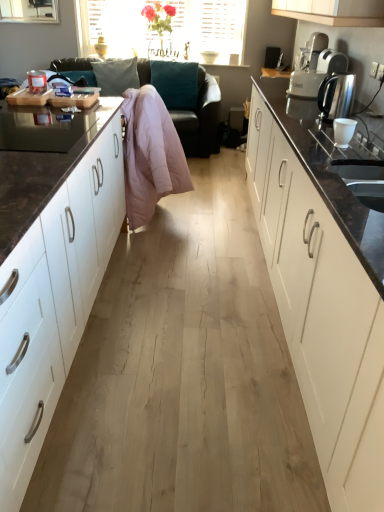
The width and height of the screenshot is (384, 512). I want to click on blank space situated above white plastic toaster at upper right (from a real-world perspective), so click(336, 46).